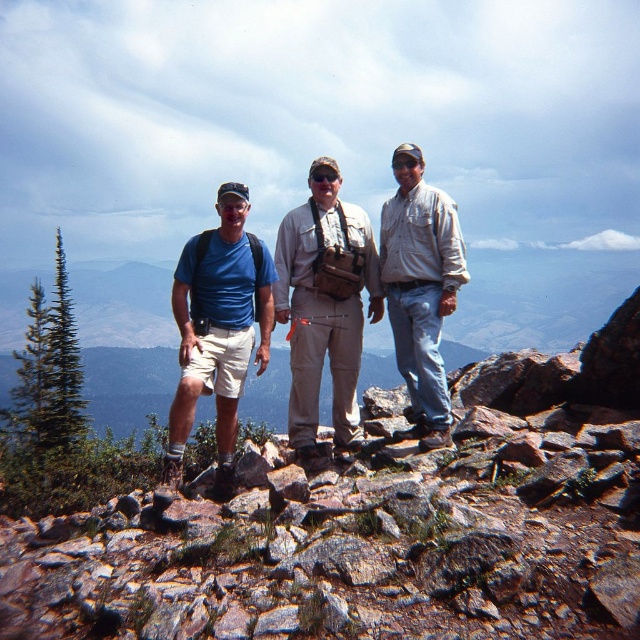
In the scene shown: You are a photographer trying to capture a group photo of the matte blue shirt at center and the light brown shirt at center. The camera you are using has a maximum width capacity of 1.2 meters. Can both subjects fit within the frame if they stand side by side?

The matte blue shirt at center might be wider than light brown shirt at center, but since the exact width isn

Based on the photo, you are a photographer trying to capture a group photo of the matte blue shirt at center and the light brown shirt at center. Which person should you focus on first if you want to ensure both are in frame without moving the camera?

You should focus on the matte blue shirt at center first because it is larger in size compared to the light brown shirt at center, ensuring it fits within the frame before adjusting for the smaller one.